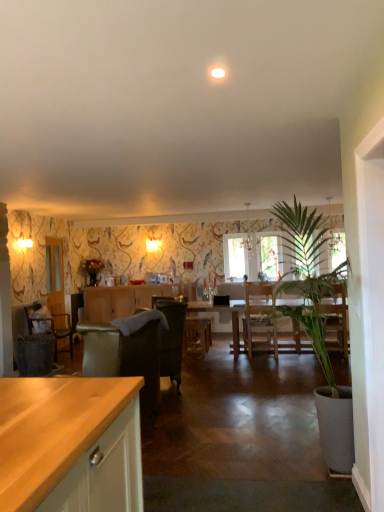
Question: Is wooden chair at left, the first chair from the back, to the right of clear glass door at left from the viewer's perspective?

Choices:
 (A) no
 (B) yes

Answer: (B)

Question: From a real-world perspective, is wooden chair at left, the first chair from the back, physically below clear glass door at left?

Choices:
 (A) no
 (B) yes

Answer: (B)

Question: Does wooden chair at left, positioned as the first chair in left-to-right order, have a greater height compared to clear glass door at left?

Choices:
 (A) no
 (B) yes

Answer: (A)

Question: From the image's perspective, is wooden chair at left, acting as the second chair starting from the front, under clear glass door at left?

Choices:
 (A) no
 (B) yes

Answer: (B)

Question: Is wooden chair at left, positioned as the first chair in left-to-right order, behind clear glass door at left?

Choices:
 (A) yes
 (B) no

Answer: (B)

Question: Can clear glass door at left be found inside wooden chair at left, the second chair from the right?

Choices:
 (A) no
 (B) yes

Answer: (A)

Question: Does green leafy plant at right appear on the right side of wooden cabinet at center?

Choices:
 (A) yes
 (B) no

Answer: (A)

Question: Does green leafy plant at right have a greater width compared to wooden cabinet at center?

Choices:
 (A) no
 (B) yes

Answer: (B)

Question: Considering the relative sizes of green leafy plant at right and wooden cabinet at center in the image provided, is green leafy plant at right bigger than wooden cabinet at center?

Choices:
 (A) yes
 (B) no

Answer: (A)

Question: Is green leafy plant at right far away from wooden cabinet at center?

Choices:
 (A) no
 (B) yes

Answer: (B)

Question: From the image's perspective, is green leafy plant at right beneath wooden cabinet at center?

Choices:
 (A) yes
 (B) no

Answer: (B)

Question: Is green leafy plant at right facing away from wooden cabinet at center?

Choices:
 (A) no
 (B) yes

Answer: (A)

Question: Can you confirm if velvet dark brown armchair at center, placed as the 1th chair when sorted from front to back, is bigger than metallic chandelier at center?

Choices:
 (A) no
 (B) yes

Answer: (B)